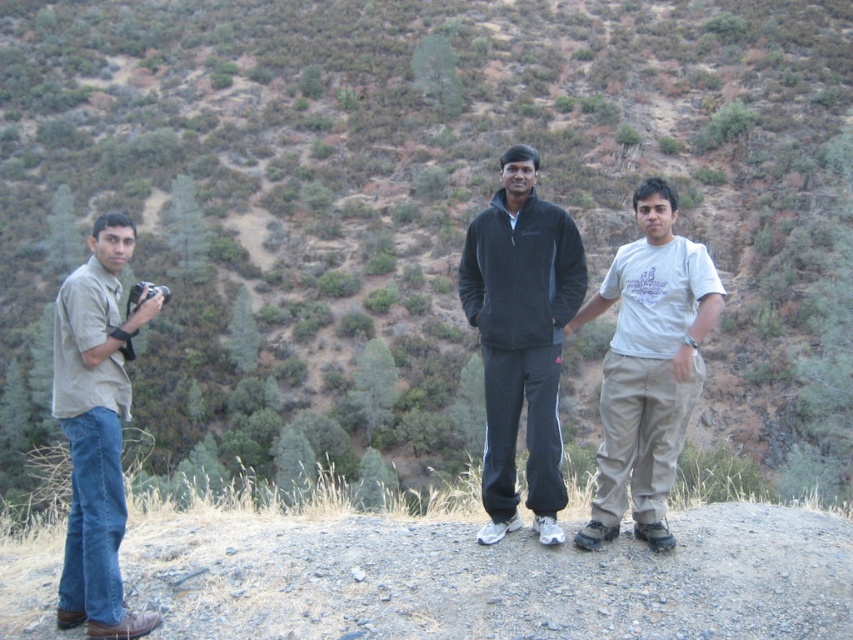
You are standing at point (682,416) and want to walk to the rocky outcrop where the three people are standing. Which direction should you move relative to point (358,573)?

You should move towards point (358,573) because it is in front of point (682,416), meaning it is closer to the rocky outcrop where the people are standing.